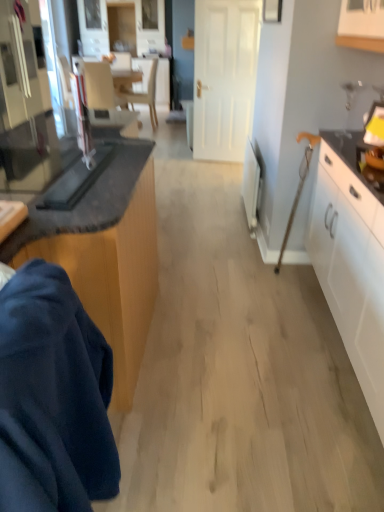
Question: Is the surface of white matte door at center in direct contact with dark blue fabric at lower left?

Choices:
 (A) no
 (B) yes

Answer: (A)

Question: Considering the relative positions of white matte door at center and dark blue fabric at lower left in the image provided, is white matte door at center to the left of dark blue fabric at lower left from the viewer's perspective?

Choices:
 (A) yes
 (B) no

Answer: (B)

Question: From the image's perspective, does white matte door at center appear higher than dark blue fabric at lower left?

Choices:
 (A) no
 (B) yes

Answer: (B)

Question: Can you confirm if white matte door at center is taller than dark blue fabric at lower left?

Choices:
 (A) yes
 (B) no

Answer: (A)

Question: Is white matte door at center thinner than dark blue fabric at lower left?

Choices:
 (A) yes
 (B) no

Answer: (A)

Question: Could you tell me if white matte door at center is facing dark blue fabric at lower left?

Choices:
 (A) yes
 (B) no

Answer: (A)

Question: Could you tell me if white plastic radiator at right, which is the first appliance in back-to-front order, is turned towards white matte door at center?

Choices:
 (A) no
 (B) yes

Answer: (A)

Question: Considering the relative sizes of white plastic radiator at right, the 2th appliance from the front, and white matte door at center in the image provided, is white plastic radiator at right, the 2th appliance from the front, bigger than white matte door at center?

Choices:
 (A) yes
 (B) no

Answer: (B)

Question: Is white plastic radiator at right, the 2th appliance from the left, next to white matte door at center and touching it?

Choices:
 (A) no
 (B) yes

Answer: (A)

Question: Are white plastic radiator at right, which is the first appliance in back-to-front order, and white matte door at center far apart?

Choices:
 (A) yes
 (B) no

Answer: (A)

Question: Is white plastic radiator at right, the 2th appliance from the front, closer to camera compared to white matte door at center?

Choices:
 (A) no
 (B) yes

Answer: (B)

Question: From a real-world perspective, is white plastic radiator at right, the 2th appliance from the left, under white matte door at center?

Choices:
 (A) no
 (B) yes

Answer: (B)

Question: Is matte gray armchair at upper left positioned before white plastic radiator at right, the 2th appliance from the left?

Choices:
 (A) no
 (B) yes

Answer: (A)